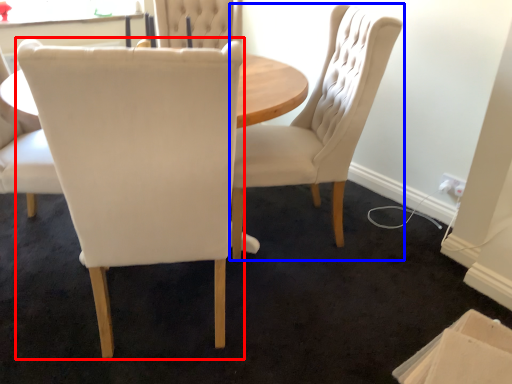
Question: Which object is further to the camera taking this photo, chair (highlighted by a red box) or chair (highlighted by a blue box)?

Choices:
 (A) chair
 (B) chair

Answer: (B)